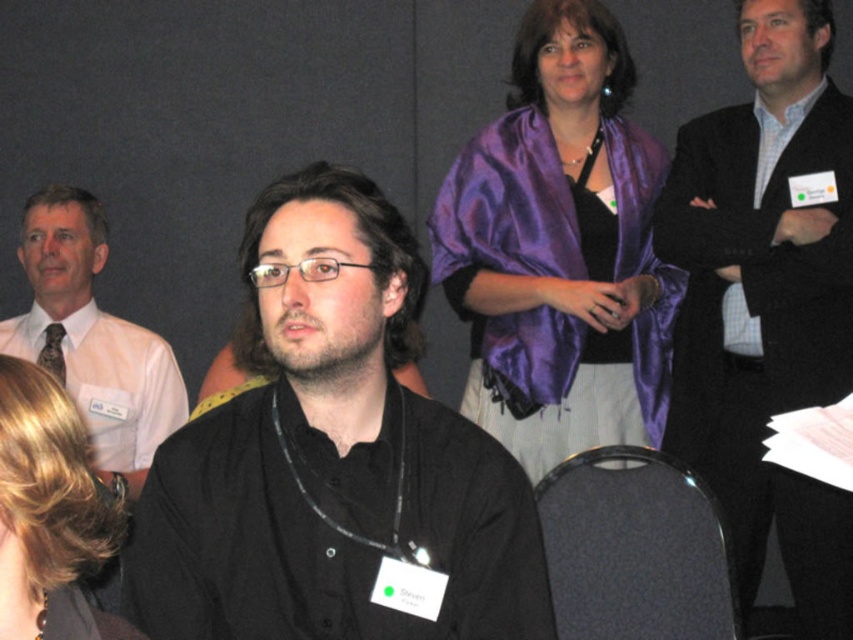
You are organizing a photo shoot and need to ensure that the purple satin shawl at upper center and the black fabric chair at lower center are visible in the frame. Based on their positions, which object is closer to the left edge of the image?

The purple satin shawl at upper center is positioned on the left side of the black fabric chair at lower center, so it is closer to the left edge of the image.

In the image, there are a black matte shirt at center and a purple satin shawl at upper center. Which one is positioned to the left?

The black matte shirt at center is positioned to the left of the purple satin shawl at upper center.

You are standing at the center of the image and want to move towards the point that is closer to you. Which point should you move towards, point (x=300, y=422) or point (x=633, y=442)?

You should move towards point (x=300, y=422) because it is in front of point (x=633, y=442).